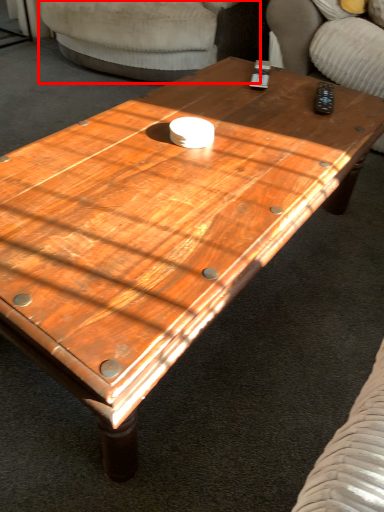
Question: From the image's perspective, considering the relative positions of armchair (annotated by the red box) and armchair in the image provided, where is armchair (annotated by the red box) located with respect to the staircase?

Choices:
 (A) above
 (B) below

Answer: (A)